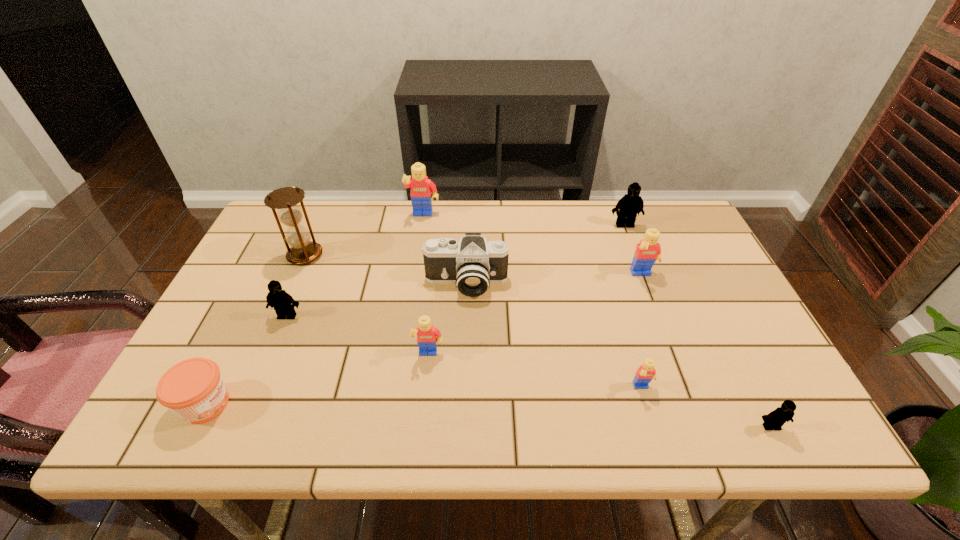
Find the location of `brown hourglass`. brown hourglass is located at coordinates (302, 251).

Where is `hourglass`? This screenshot has width=960, height=540. hourglass is located at coordinates point(302,251).

I want to click on the tallest Lego, so click(421, 187).

Image resolution: width=960 pixels, height=540 pixels. In order to click on the biggest yellow Lego in this screenshot , I will do `click(421, 187)`.

The image size is (960, 540). Find the location of `the farthest black Lego`. the farthest black Lego is located at coordinates (630, 204).

Where is `the second black Lego from right to left`? the second black Lego from right to left is located at coordinates (630, 204).

Locate an element on the screen. the fifth nearest Lego is located at coordinates (648, 251).

At what (x,y) coordinates should I click in order to perform the action: click on the third smallest yellow Lego. Please return your answer as a coordinate pair (x, y). Looking at the image, I should click on (648, 251).

Locate an element on the screen. Image resolution: width=960 pixels, height=540 pixels. camera is located at coordinates (472, 263).

Identify the location of the fourth farthest Lego. This screenshot has height=540, width=960. (283, 303).